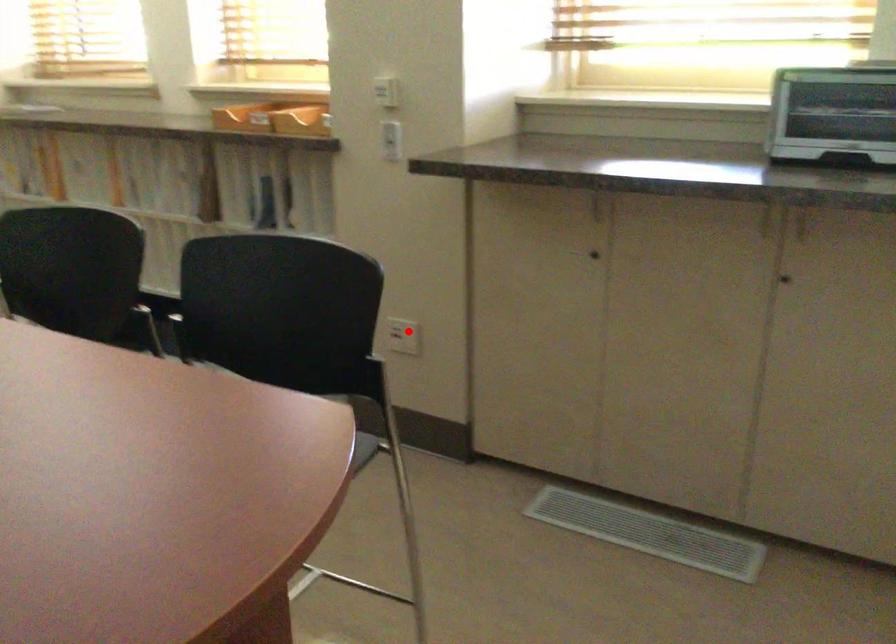
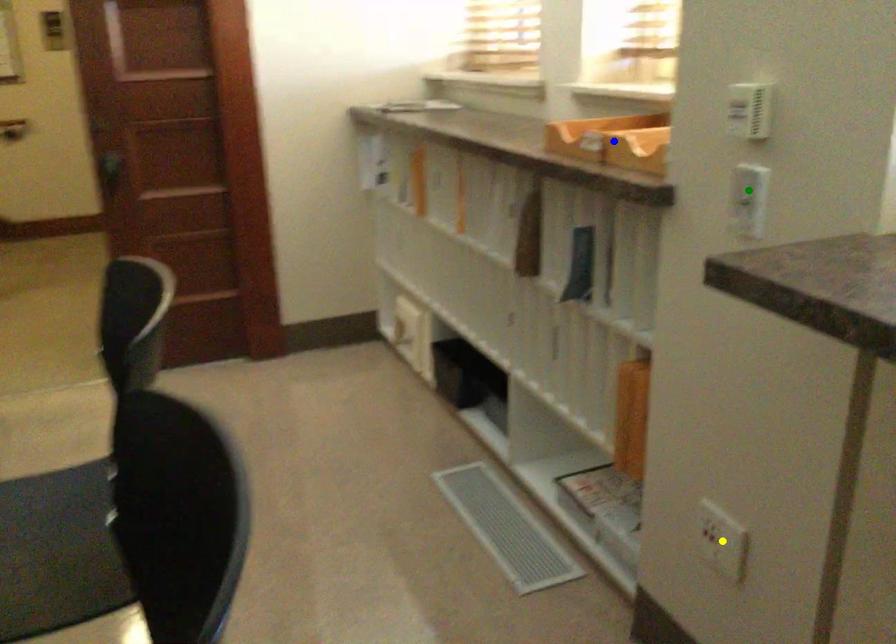
Question: I am providing you with two images of the same scene from different viewpoints. A red point is marked on the first image. You are given multiple points on the second image. Which mark in image 2 goes with the point in image 1?

Choices:
 (A) blue point
 (B) green point
 (C) yellow point

Answer: (C)